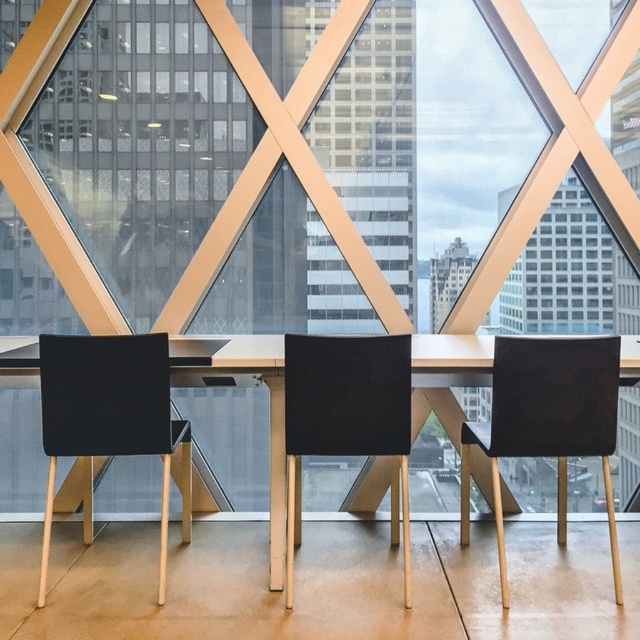
You are standing at the center of the office and want to move to the black fabric chair at right. According to the coordinates provided, in which direction should you move relative to the office layout?

The black fabric chair at right is located at coordinates point [547,422], so you should move towards the right side of the office to reach it.